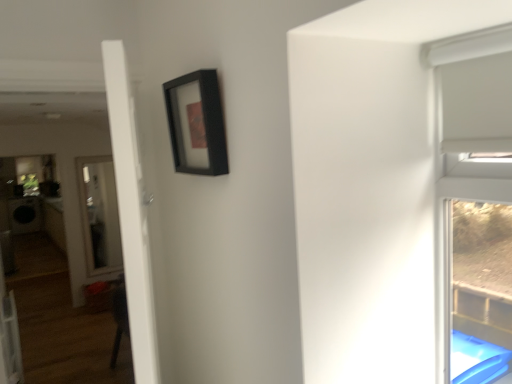
Based on the photo, measure the distance between point (134, 251) and camera.

Point (134, 251) and camera are 34.45 inches apart.

Locate an element on the screen. Image resolution: width=512 pixels, height=384 pixels. white glossy door at left is located at coordinates (131, 213).

The width and height of the screenshot is (512, 384). What do you see at coordinates (131, 213) in the screenshot?
I see `white glossy door at left` at bounding box center [131, 213].

I want to click on black matte picture frame at upper center, so click(x=197, y=123).

What do you see at coordinates (197, 123) in the screenshot? I see `black matte picture frame at upper center` at bounding box center [197, 123].

What is the approximate width of black matte picture frame at upper center?

It is 2.56 inches.

The width and height of the screenshot is (512, 384). Find the location of `white glossy door at left`. white glossy door at left is located at coordinates (131, 213).

Between white glossy door at left and black matte picture frame at upper center, which one appears on the right side from the viewer's perspective?

black matte picture frame at upper center is more to the right.

Which object is more forward, white glossy door at left or black matte picture frame at upper center?

white glossy door at left.

Is point (153, 368) positioned behind point (223, 142)?

No.

From the image's perspective, is white glossy door at left above or below black matte picture frame at upper center?

Based on their image positions, white glossy door at left is located beneath black matte picture frame at upper center.

From a real-world perspective, who is located higher, white glossy door at left or black matte picture frame at upper center?

black matte picture frame at upper center.

Does white glossy door at left have a lesser width compared to black matte picture frame at upper center?

Incorrect, the width of white glossy door at left is not less than that of black matte picture frame at upper center.

Between white glossy door at left and black matte picture frame at upper center, which one has more height?

white glossy door at left.

Consider the image. Does white glossy door at left have a larger size compared to black matte picture frame at upper center?

Indeed, white glossy door at left has a larger size compared to black matte picture frame at upper center.

From the picture: Would you say white glossy door at left is outside black matte picture frame at upper center?

Yes, white glossy door at left is located beyond the bounds of black matte picture frame at upper center.

Would you consider white glossy door at left to be distant from black matte picture frame at upper center?

No, white glossy door at left is not far away from black matte picture frame at upper center.

Could you tell me if white glossy door at left is facing black matte picture frame at upper center?

Yes, white glossy door at left is turned towards black matte picture frame at upper center.

Can you tell me how much white glossy door at left and black matte picture frame at upper center differ in facing direction?

They differ by 18.7 degrees in their facing directions.

Locate an element on the screen. The height and width of the screenshot is (384, 512). door below the black matte picture frame at upper center (from the image's perspective) is located at coordinates (131, 213).

Is black matte picture frame at upper center to the right of white glossy door at left from the viewer's perspective?

Yes, black matte picture frame at upper center is to the right of white glossy door at left.

Does black matte picture frame at upper center come behind white glossy door at left?

Yes, black matte picture frame at upper center is further from the camera.

Which is closer to the camera, (221, 171) or (121, 176)?

Positioned in front is point (121, 176).

From the image's perspective, which one is positioned higher, black matte picture frame at upper center or white glossy door at left?

From the image's view, black matte picture frame at upper center is above.

In the scene shown: From a real-world perspective, does black matte picture frame at upper center sit lower than white glossy door at left?

No, from a real-world perspective, black matte picture frame at upper center is not below white glossy door at left.

In the scene shown: Considering the sizes of objects black matte picture frame at upper center and white glossy door at left in the image provided, who is thinner, black matte picture frame at upper center or white glossy door at left?

black matte picture frame at upper center.

Considering the relative sizes of black matte picture frame at upper center and white glossy door at left in the image provided, is black matte picture frame at upper center taller than white glossy door at left?

In fact, black matte picture frame at upper center may be shorter than white glossy door at left.

Who is bigger, black matte picture frame at upper center or white glossy door at left?

white glossy door at left is bigger.

Would you say black matte picture frame at upper center is inside or outside white glossy door at left?

black matte picture frame at upper center exists outside the volume of white glossy door at left.

Is black matte picture frame at upper center with white glossy door at left?

No, black matte picture frame at upper center is not with white glossy door at left.

Is black matte picture frame at upper center turned away from white glossy door at left?

No, black matte picture frame at upper center is not facing the opposite direction of white glossy door at left.

The height and width of the screenshot is (384, 512). Identify the location of picture frame that is above the white glossy door at left (from the image's perspective). (197, 123).

Image resolution: width=512 pixels, height=384 pixels. What are the coordinates of `picture frame to the right of white glossy door at left` in the screenshot? It's located at (197, 123).

I want to click on picture frame located above the white glossy door at left (from a real-world perspective), so click(197, 123).